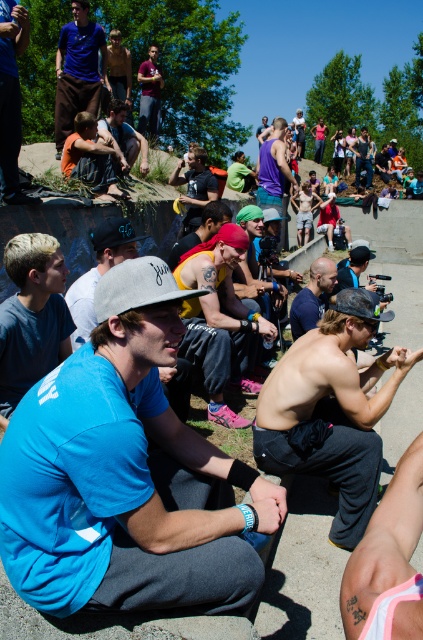
Between yellow t-shirt at center and matte yellow cap at center, which one has more height?

yellow t-shirt at center

Locate an element on the screen. This screenshot has width=423, height=640. yellow t-shirt at center is located at coordinates (219, 321).

Does blue matte shirt at lower left have a larger size compared to matte black cap at center?

Actually, blue matte shirt at lower left might be smaller than matte black cap at center.

Who is more forward, [11,340] or [131,141]?

Point [11,340] is more forward.

Find the location of a particular element. Image resolution: width=423 pixels, height=640 pixels. blue matte shirt at lower left is located at coordinates (32, 316).

Describe the element at coordinates (274, 168) in the screenshot. Image resolution: width=423 pixels, height=640 pixels. I see `matte purple tank top at center` at that location.

Does matte purple tank top at center appear over blue t-shirt at center?

Indeed, matte purple tank top at center is positioned over blue t-shirt at center.

The width and height of the screenshot is (423, 640). Find the location of `matte purple tank top at center`. matte purple tank top at center is located at coordinates [x=274, y=168].

This screenshot has width=423, height=640. Find the location of `matte purple tank top at center`. matte purple tank top at center is located at coordinates (274, 168).